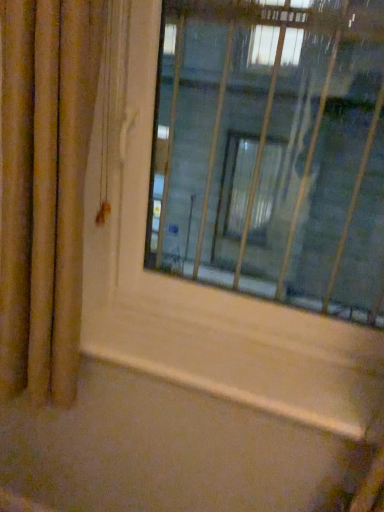
Question: From the image's perspective, does wooden at lower center appear higher than gold textured curtain at left?

Choices:
 (A) yes
 (B) no

Answer: (B)

Question: Considering the relative sizes of wooden at lower center and gold textured curtain at left in the image provided, is wooden at lower center bigger than gold textured curtain at left?

Choices:
 (A) yes
 (B) no

Answer: (B)

Question: Is the depth of wooden at lower center less than that of gold textured curtain at left?

Choices:
 (A) no
 (B) yes

Answer: (A)

Question: Is wooden at lower center not near gold textured curtain at left?

Choices:
 (A) no
 (B) yes

Answer: (A)

Question: Is wooden at lower center smaller than gold textured curtain at left?

Choices:
 (A) no
 (B) yes

Answer: (B)

Question: Considering the positions of gold textured curtain at left and transparent glass window at center in the image, is gold textured curtain at left bigger or smaller than transparent glass window at center?

Choices:
 (A) small
 (B) big

Answer: (A)

Question: Is gold textured curtain at left taller or shorter than transparent glass window at center?

Choices:
 (A) short
 (B) tall

Answer: (B)

Question: In the image, is gold textured curtain at left on the left side or the right side of transparent glass window at center?

Choices:
 (A) left
 (B) right

Answer: (A)

Question: Is point click(x=49, y=66) closer or farther from the camera than point click(x=203, y=142)?

Choices:
 (A) farther
 (B) closer

Answer: (B)

Question: Which is correct: wooden at lower center is inside gold textured curtain at left, or outside of it?

Choices:
 (A) outside
 (B) inside

Answer: (A)

Question: Looking at their shapes, would you say wooden at lower center is wider or thinner than gold textured curtain at left?

Choices:
 (A) wide
 (B) thin

Answer: (A)

Question: From a real-world perspective, relative to gold textured curtain at left, is wooden at lower center vertically above or below?

Choices:
 (A) below
 (B) above

Answer: (A)

Question: In the image, is wooden at lower center on the left side or the right side of gold textured curtain at left?

Choices:
 (A) left
 (B) right

Answer: (B)

Question: From a real-world perspective, is wooden at lower center positioned above or below transparent glass window at center?

Choices:
 (A) above
 (B) below

Answer: (B)

Question: Visually, is wooden at lower center positioned to the left or to the right of transparent glass window at center?

Choices:
 (A) right
 (B) left

Answer: (B)